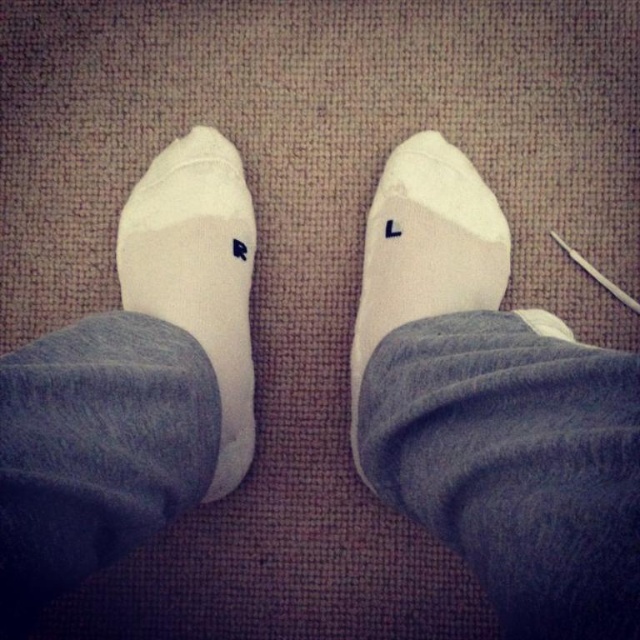
Measure the distance from white matte socks at left to white soft socks at center.

white matte socks at left is 19.41 centimeters from white soft socks at center.

Does white matte socks at left have a smaller size compared to white soft socks at center?

Incorrect, white matte socks at left is not smaller in size than white soft socks at center.

Is point (180, 268) positioned behind point (396, 205)?

No, (180, 268) is in front of (396, 205).

Locate an element on the screen. The width and height of the screenshot is (640, 640). white matte socks at left is located at coordinates (198, 273).